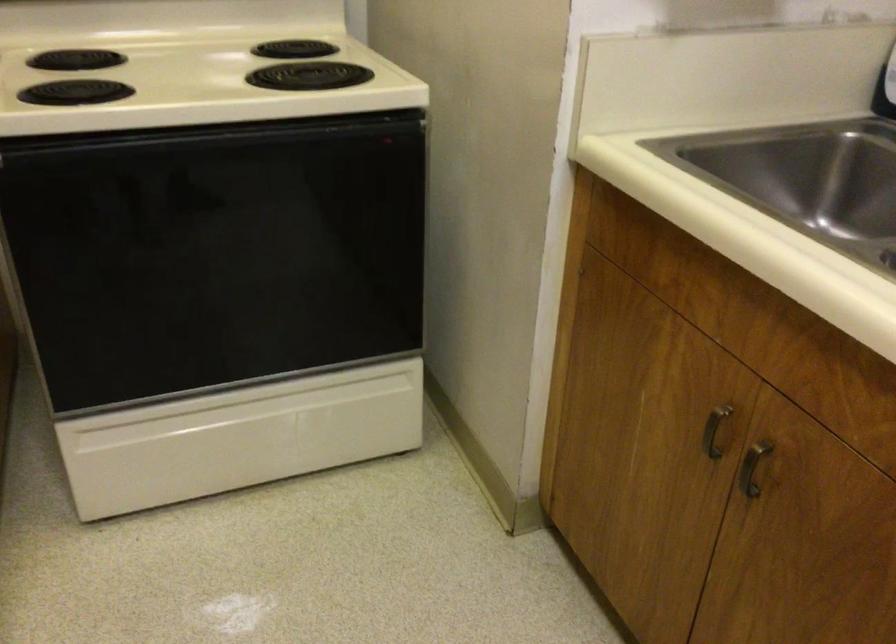
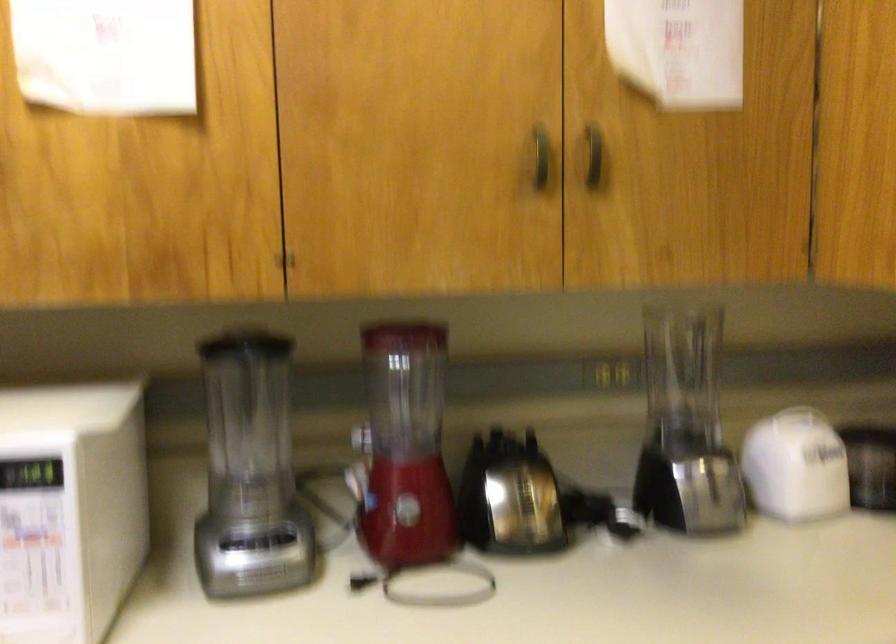
Question: How did the camera likely rotate?

Choices:
 (A) Left
 (B) Right
 (C) Up
 (D) Down

Answer: (A)